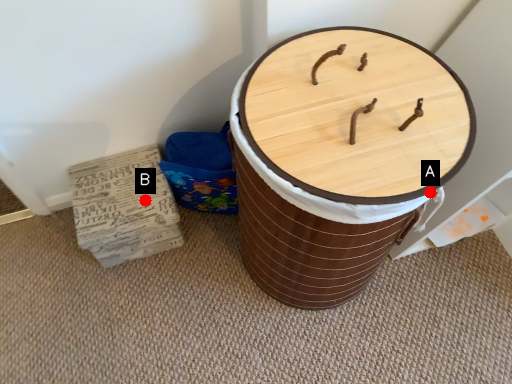
Question: Two points are circled on the image, labeled by A and B beside each circle. Which point is farther from the camera taking this photo?

Choices:
 (A) A is further
 (B) B is further

Answer: (B)